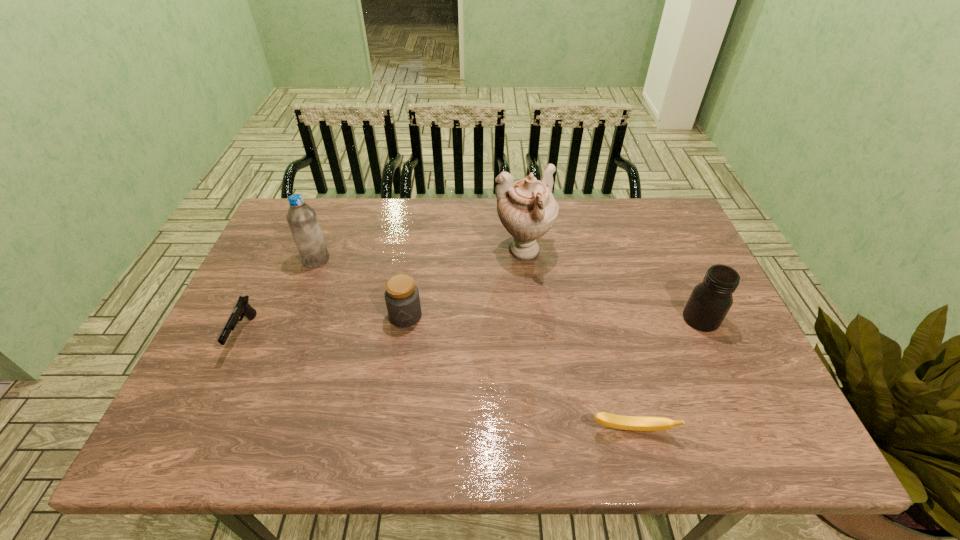
Image resolution: width=960 pixels, height=540 pixels. In order to click on urn in this screenshot , I will do `click(527, 209)`.

At what (x,y) coordinates should I click in order to perform the action: click on the tallest object. Please return your answer as a coordinate pair (x, y). Looking at the image, I should click on pyautogui.click(x=527, y=209).

What are the coordinates of `the second tallest object` in the screenshot? It's located at pyautogui.click(x=302, y=220).

What are the coordinates of `the fifth object from right to left` in the screenshot? It's located at (302, 220).

You are a GUI agent. You are given a task and a screenshot of the screen. Output one action in this format:
    pyautogui.click(x=<x>, y=<y>)
    Task: Click on the taller jar
    This screenshot has height=540, width=960.
    Given the screenshot: What is the action you would take?
    pyautogui.click(x=710, y=300)

I want to click on the right jar, so click(x=710, y=300).

This screenshot has width=960, height=540. Identify the location of the left jar. (402, 299).

Where is `the fourth tallest object`? the fourth tallest object is located at coordinates (402, 299).

Where is `the leftmost object`? Image resolution: width=960 pixels, height=540 pixels. the leftmost object is located at coordinates (242, 308).

I want to click on the fifth tallest object, so click(242, 308).